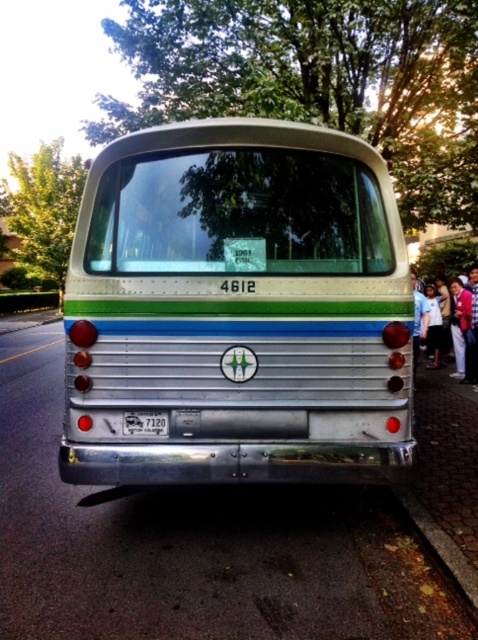
You are a delivery driver who needs to park your van behind the vintage bus. The curb is brown textured curb at lower right, and the license plate is white plastic license plate at center. Which object is closer to you when you approach the bus from behind?

The brown textured curb at lower right is closer to the viewer than the white plastic license plate at center, so when approaching the bus from behind, the brown textured curb at lower right will be closer to you.

You are a delivery person trying to park your van next to the vintage bus. You notice the brown textured curb at lower right and the matte pink clothing at right. Which object takes up more space in the scene?

The matte pink clothing at right takes up more space in the scene because the brown textured curb at lower right occupies less space than matte pink clothing at right.

You are standing on the sidewalk in front of the vintage bus. You see the point at coordinates (442, 552). Where is this point located in relation to the bus?

The point at coordinates (442, 552) is on the brown textured curb at lower right, which is outside the bus.